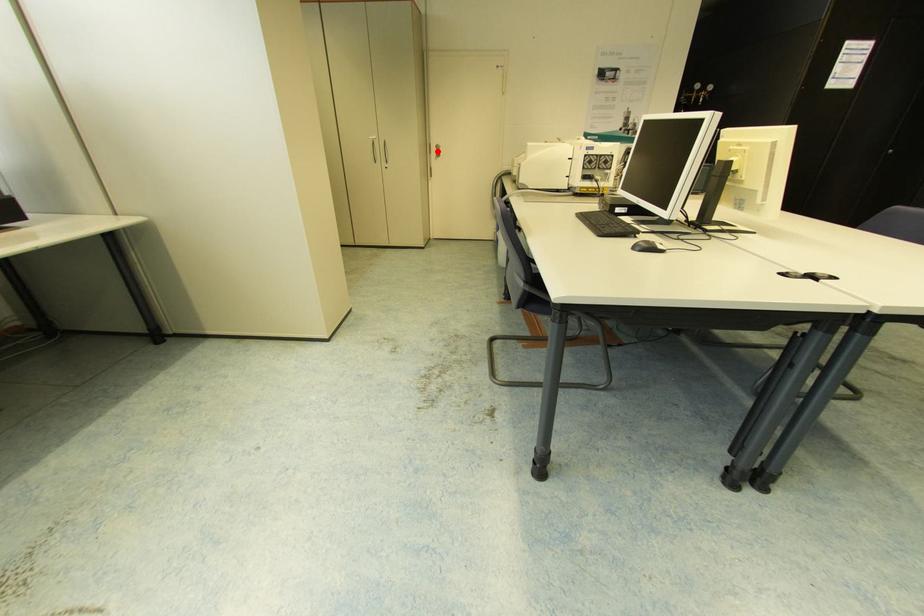
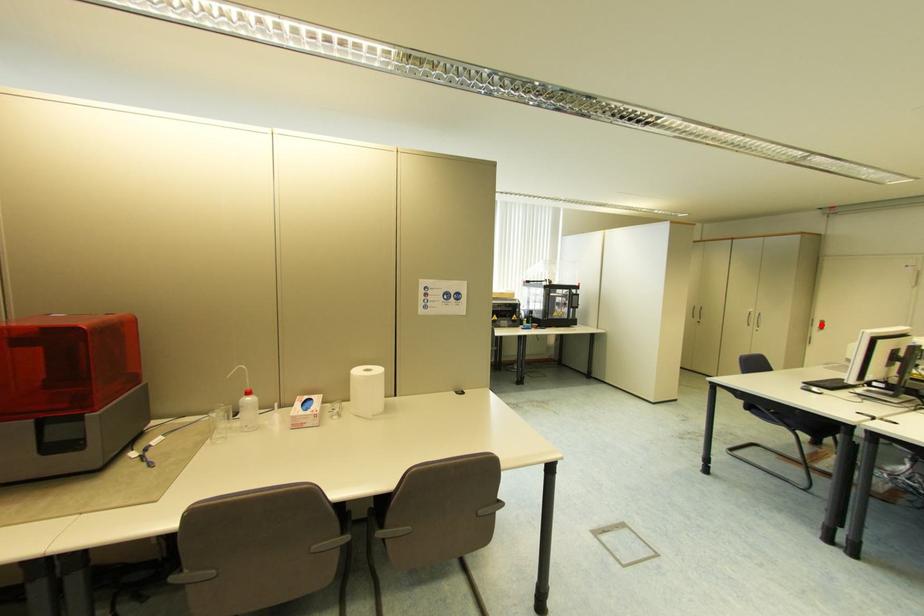
I am providing you with two images of the same scene from different viewpoints. A red point is marked on the first image and another point is marked on the second image. Is the marked point in image1 the same physical position as the marked point in image2?

Yes